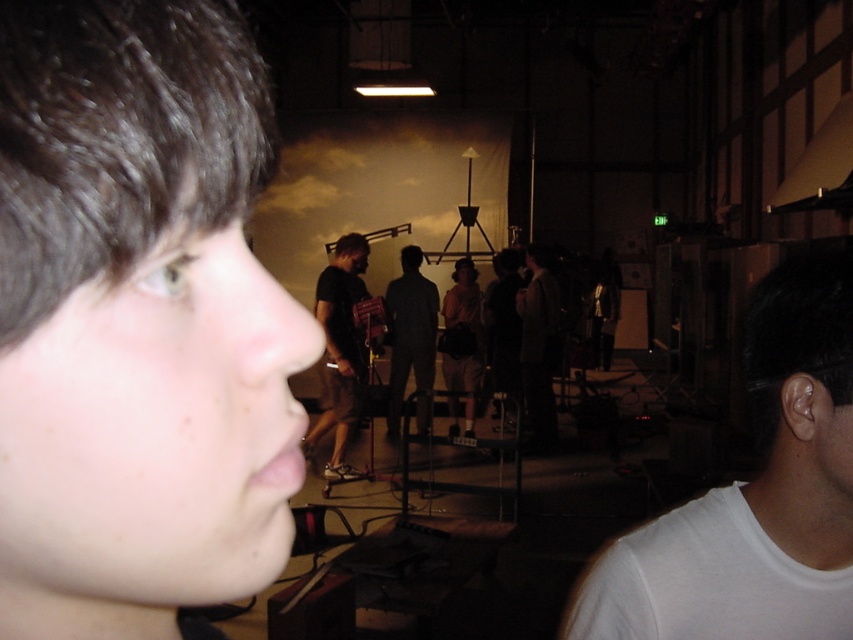
Question: Which object appears farthest from the camera in this image?

Choices:
 (A) dark gray suit at center
 (B) smooth skin face at left
 (C) white matte t-shirt at right

Answer: (A)

Question: Estimate the real-world distances between objects in this image. Which object is farther from the dark gray suit at center?

Choices:
 (A) smooth skin face at left
 (B) khaki cotton shorts at center
 (C) dark gray pants at center
 (D) white matte t-shirt at right

Answer: (A)

Question: Considering the relative positions of white matte t-shirt at right and black matte shorts at center in the image provided, where is white matte t-shirt at right located with respect to black matte shorts at center?

Choices:
 (A) below
 (B) above

Answer: (B)

Question: Observing the image, what is the correct spatial positioning of white matte t-shirt at right in reference to dark gray pants at center?

Choices:
 (A) above
 (B) below

Answer: (A)

Question: Among these objects, which one is farthest from the camera?

Choices:
 (A) dark gray suit at center
 (B) smooth skin face at left
 (C) black matte shorts at center
 (D) khaki cotton shorts at center

Answer: (D)

Question: Can you confirm if white matte t-shirt at right is positioned below khaki cotton shorts at center?

Choices:
 (A) yes
 (B) no

Answer: (B)